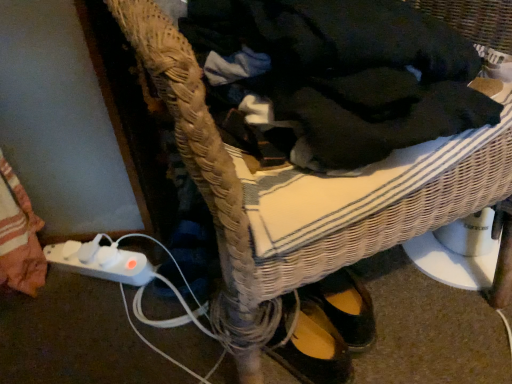
Identify the location of free space in front of white plastic plug at lower left. (89, 322).